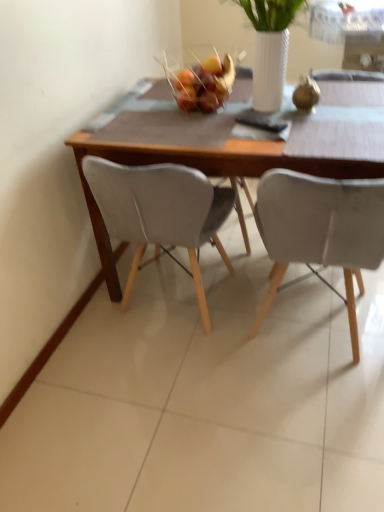
Question: From a real-world perspective, is matte gray chair at center, marked as the 2th chair in a right-to-left arrangement, physically located above or below wooden table at center?

Choices:
 (A) above
 (B) below

Answer: (A)

Question: Is matte gray chair at center, marked as the 2th chair in a right-to-left arrangement, situated inside wooden table at center or outside?

Choices:
 (A) outside
 (B) inside

Answer: (B)

Question: Which of these objects is positioned farthest from the glossy plastic fruit basket at center?

Choices:
 (A) white matte chair at right, marked as the second chair in a left-to-right arrangement
 (B) wooden table at center
 (C) matte gray chair at center, placed as the first chair when sorted from left to right

Answer: (A)

Question: Estimate the real-world distances between objects in this image. Which object is closer to the wooden table at center?

Choices:
 (A) glossy plastic fruit basket at center
 (B) matte gray chair at center, placed as the first chair when sorted from left to right
 (C) white matte chair at right, which is the first chair in right-to-left order

Answer: (B)